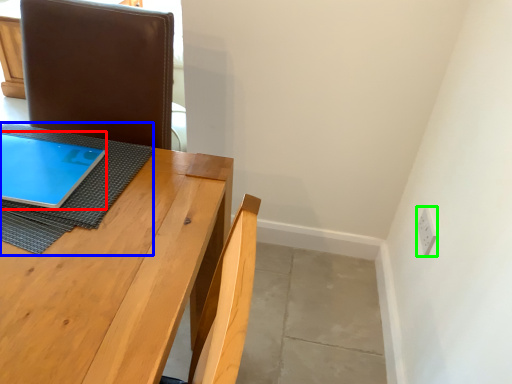
Question: Based on their relative distances, which object is farther from tablet computer (highlighted by a red box)? Choose from cloth (highlighted by a blue box) and electric outlet (highlighted by a green box).

Choices:
 (A) cloth
 (B) electric outlet

Answer: (B)